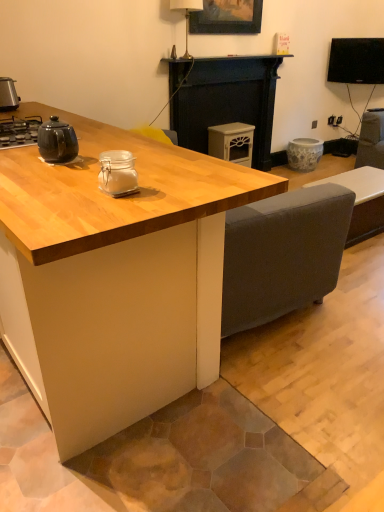
Question: From the image's perspective, is wooden picture frame at upper center under metallic silver toaster at left, marked as the 3th appliance in a back-to-front arrangement?

Choices:
 (A) no
 (B) yes

Answer: (A)

Question: Can you confirm if wooden picture frame at upper center is wider than metallic silver toaster at left, positioned as the first appliance in left-to-right order?

Choices:
 (A) yes
 (B) no

Answer: (B)

Question: Are wooden picture frame at upper center and metallic silver toaster at left, acting as the fourth appliance starting from the right, making contact?

Choices:
 (A) yes
 (B) no

Answer: (B)

Question: Considering the relative sizes of wooden picture frame at upper center and metallic silver toaster at left, acting as the fourth appliance starting from the right, in the image provided, is wooden picture frame at upper center bigger than metallic silver toaster at left, acting as the fourth appliance starting from the right,?

Choices:
 (A) no
 (B) yes

Answer: (B)

Question: Is the position of wooden picture frame at upper center less distant than that of metallic silver toaster at left, marked as the 3th appliance in a back-to-front arrangement?

Choices:
 (A) no
 (B) yes

Answer: (A)

Question: From the image's perspective, would you say wooden picture frame at upper center is positioned over metallic silver toaster at left, which is counted as the 2th appliance, starting from the front?

Choices:
 (A) yes
 (B) no

Answer: (A)

Question: Does wooden picture frame at upper center appear on the left side of black glossy tv at upper right?

Choices:
 (A) no
 (B) yes

Answer: (B)

Question: Is black glossy tv at upper right inside wooden picture frame at upper center?

Choices:
 (A) no
 (B) yes

Answer: (A)

Question: From the image's perspective, would you say wooden picture frame at upper center is positioned over black glossy tv at upper right?

Choices:
 (A) yes
 (B) no

Answer: (A)

Question: Is wooden picture frame at upper center smaller than black glossy tv at upper right?

Choices:
 (A) yes
 (B) no

Answer: (A)

Question: From a real-world perspective, is wooden picture frame at upper center on black glossy tv at upper right?

Choices:
 (A) yes
 (B) no

Answer: (A)

Question: From the image's perspective, does wooden picture frame at upper center appear lower than black glossy tv at upper right?

Choices:
 (A) no
 (B) yes

Answer: (A)

Question: Is porcelain floral pot at center, positioned as the 4th appliance in front-to-back order, thinner than clear glass jar at center, which ranks as the 2th appliance in left-to-right order?

Choices:
 (A) yes
 (B) no

Answer: (B)